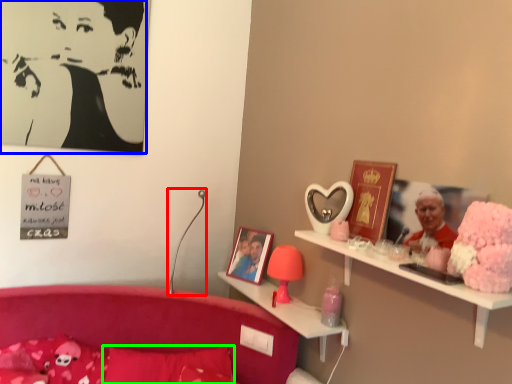
Question: Which object is positioned closest to table lamp (highlighted by a red box)? Select from person (highlighted by a blue box) and pillow (highlighted by a green box).

Choices:
 (A) person
 (B) pillow

Answer: (B)